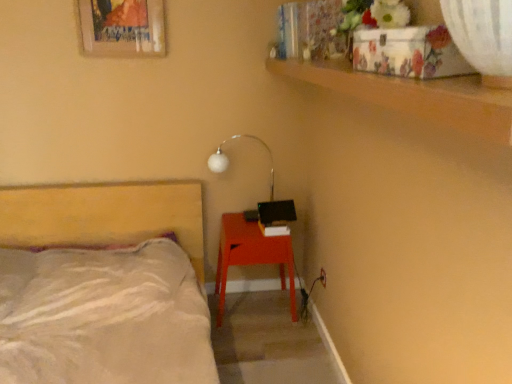
Question: Relative to matte red nightstand at lower right, is beige fabric bed at left in front or behind?

Choices:
 (A) behind
 (B) front

Answer: (B)

Question: Which is correct: beige fabric bed at left is inside matte red nightstand at lower right, or outside of it?

Choices:
 (A) outside
 (B) inside

Answer: (A)

Question: Which object is positioned farthest from the beige fabric bed at left?

Choices:
 (A) matte red nightstand at lower right
 (B) wooden picture frame at upper left
 (C) white glossy lamp at upper center

Answer: (B)

Question: Which object is positioned closest to the white glossy lamp at upper center?

Choices:
 (A) beige fabric bed at left
 (B) matte red nightstand at lower right
 (C) wooden picture frame at upper left

Answer: (B)